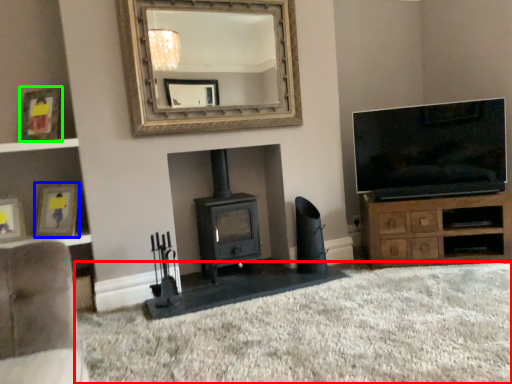
Question: Which object is positioned closest to plain (highlighted by a red box)? Select from picture frame (highlighted by a blue box) and picture frame (highlighted by a green box).

Choices:
 (A) picture frame
 (B) picture frame

Answer: (A)